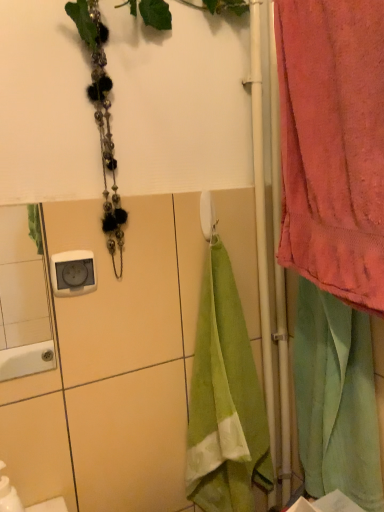
Question: Is white plastic towel bar at center turned away from pink cotton towel at right?

Choices:
 (A) yes
 (B) no

Answer: (B)

Question: From a real-world perspective, is white plastic towel bar at center below pink cotton towel at right?

Choices:
 (A) yes
 (B) no

Answer: (A)

Question: From a real-world perspective, does white plastic towel bar at center stand above pink cotton towel at right?

Choices:
 (A) no
 (B) yes

Answer: (A)

Question: From the image's perspective, would you say white plastic towel bar at center is positioned over pink cotton towel at right?

Choices:
 (A) no
 (B) yes

Answer: (A)

Question: Is white plastic towel bar at center outside pink cotton towel at right?

Choices:
 (A) yes
 (B) no

Answer: (A)

Question: Is white plastic towel bar at center to the right of pink cotton towel at right from the viewer's perspective?

Choices:
 (A) no
 (B) yes

Answer: (A)

Question: Is white plastic towel bar at center located within light green velour towel at right?

Choices:
 (A) yes
 (B) no

Answer: (B)

Question: Considering the relative sizes of light green velour towel at right and white plastic towel bar at center in the image provided, is light green velour towel at right thinner than white plastic towel bar at center?

Choices:
 (A) no
 (B) yes

Answer: (A)

Question: Does light green velour towel at right have a greater height compared to white plastic towel bar at center?

Choices:
 (A) no
 (B) yes

Answer: (B)

Question: From a real-world perspective, is light green velour towel at right located beneath white plastic towel bar at center?

Choices:
 (A) no
 (B) yes

Answer: (B)

Question: Does light green velour towel at right appear on the right side of white plastic towel bar at center?

Choices:
 (A) no
 (B) yes

Answer: (B)

Question: Is light green velour towel at right positioned far away from white plastic towel bar at center?

Choices:
 (A) no
 (B) yes

Answer: (A)

Question: Can you see pink cotton towel at right touching white plastic towel bar at center?

Choices:
 (A) yes
 (B) no

Answer: (B)